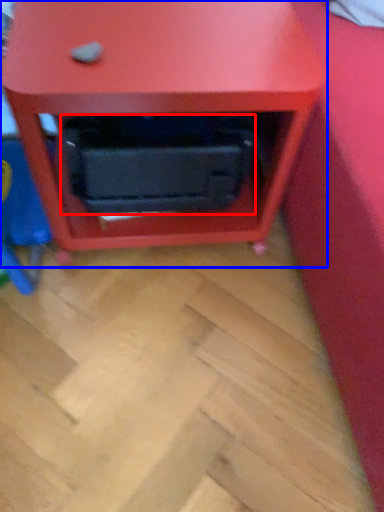
Question: Which object is further to the camera taking this photo, drawer (highlighted by a red box) or furniture (highlighted by a blue box)?

Choices:
 (A) drawer
 (B) furniture

Answer: (A)